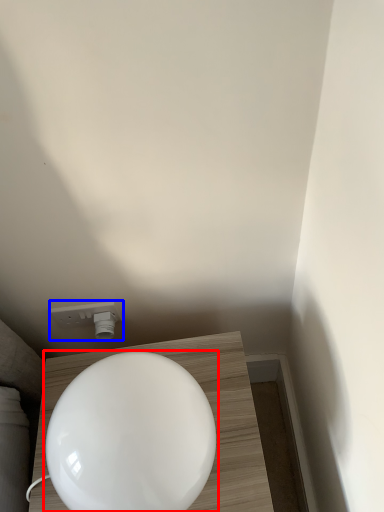
Question: Which object appears closest to the camera in this image, toilet (highlighted by a red box) or light fixture (highlighted by a blue box)?

Choices:
 (A) toilet
 (B) light fixture

Answer: (A)